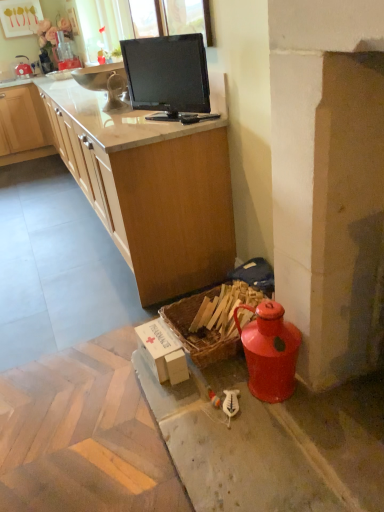
You are a GUI agent. You are given a task and a screenshot of the screen. Output one action in this format:
    pyautogui.click(x=<x>, y=<y>)
    Task: Click on the vacant space situated above white cardboard box at lower center (from a real-world perspective)
    
    Given the screenshot: What is the action you would take?
    pyautogui.click(x=160, y=340)